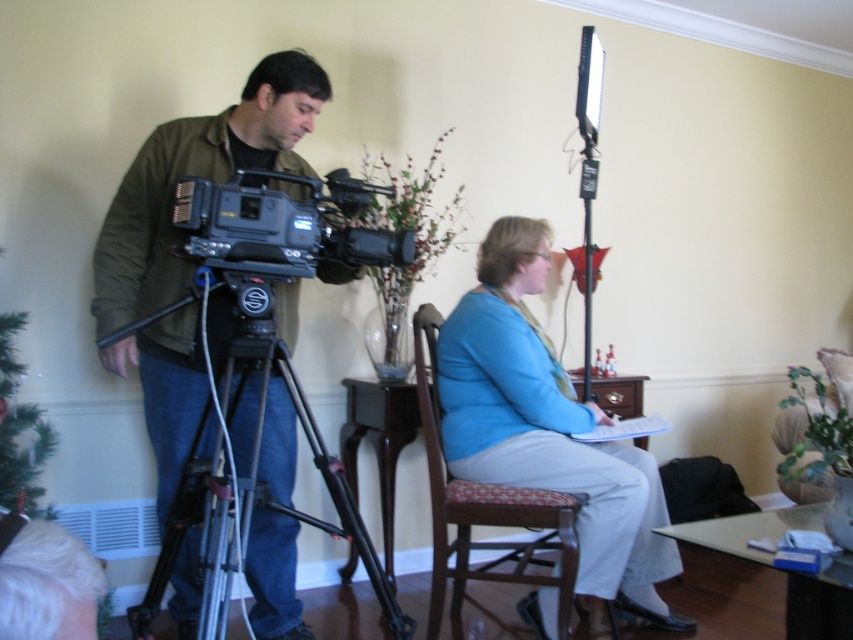
In the scene shown: You are a camera operator who needs to adjust the position of the matte black camera at left and the silver metallic tripod at left. Based on the scene, which object is closer to the left edge of the frame?

The matte black camera at left is closer to the left edge of the frame because it is positioned to the left of the silver metallic tripod at left.

You are setting up a video call and need to position your camera so that it is higher than the woodenchair at center. Given that the matte black camera at left is already positioned, can you confirm if it meets the requirement?

The matte black camera at left has a greater height compared to woodenchair at center, so yes, it meets the requirement of being higher than the woodenchair at center.